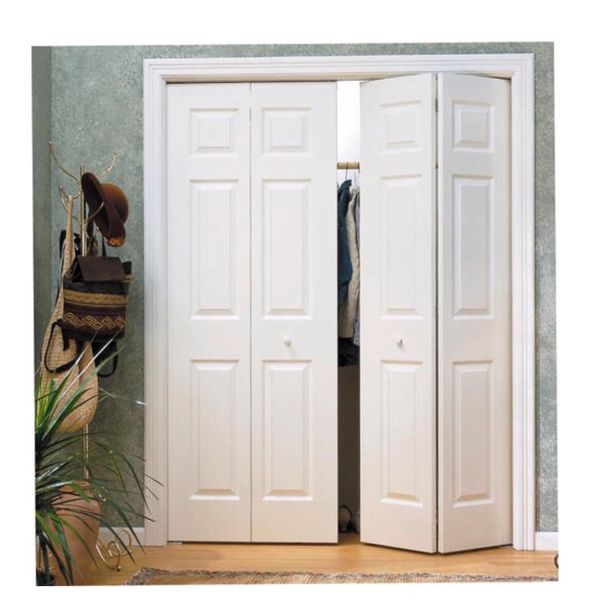
I want to click on wall, so click(x=86, y=114).